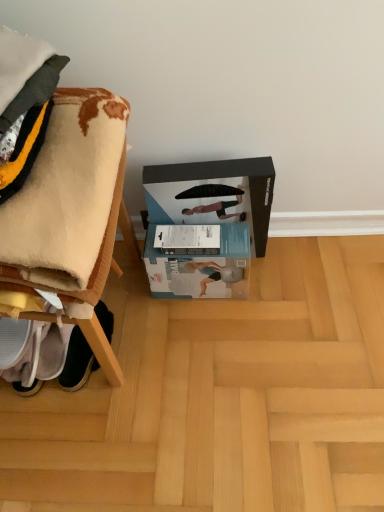
What are the coordinates of `vacant space to the right of white cardboard box at center` in the screenshot? It's located at (278, 285).